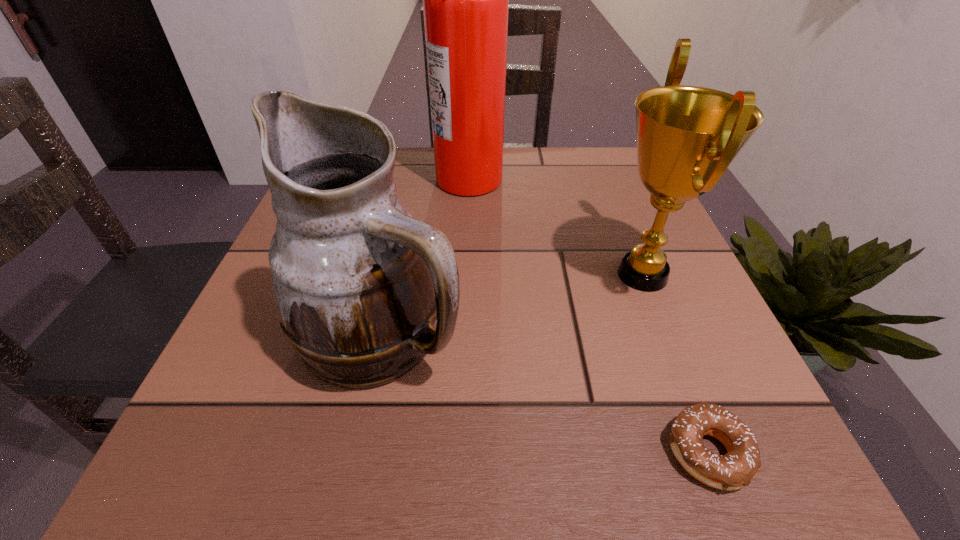
Locate an element on the screen. vacant position in the image that satisfies the following two spatial constraints: 1. at the nozzle of the farthest object; 2. on the left side of the doughnut is located at coordinates point(460,453).